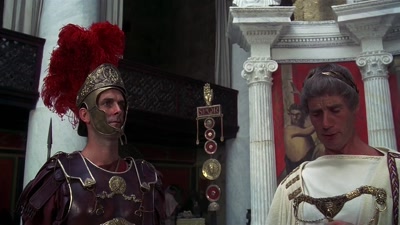
Locate an element on the screen. This screenshot has width=400, height=225. columns is located at coordinates (262, 116), (384, 112), (70, 12).